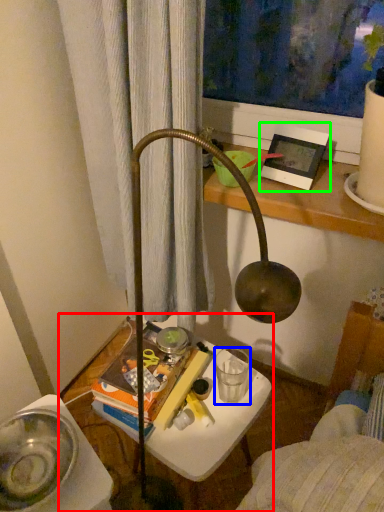
Question: Which object is the closest to the table (highlighted by a red box)? Choose among these: beverage (highlighted by a blue box) or picture frame (highlighted by a green box).

Choices:
 (A) beverage
 (B) picture frame

Answer: (A)